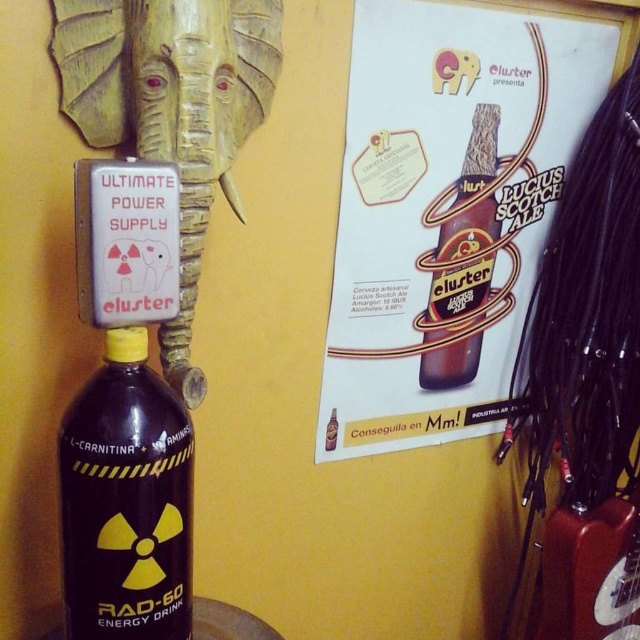
You are standing in front of the yellow wall with the elephant sculpture and the Lucius Scotch Ale poster. A small drone is hovering at point (196, 134). If the drone moves straight toward you, how far will it travel before reaching your position?

The point (196, 134) is 29.54 inches away from the viewer. Therefore, the drone will travel 29.54 inches to reach you.

You are an interior designer assessing the wall layout. The client wants to know if the matte paper poster at upper right and wooden elephant head at upper left are arranged in a way that the poster is positioned to the right of the elephant head. Can you confirm this?

Yes, the matte paper poster at upper right is positioned to the right of the wooden elephant head at upper left, as described.

You are an interior designer planning to hang a new picture between the matte paper poster at upper right and the brown glass bottle at upper center. Considering their sizes, which object should you place higher on the wall to maintain visual balance?

The matte paper poster at upper right is much taller than the brown glass bottle at upper center, so to maintain visual balance, you should place the matte paper poster at upper right higher on the wall to compensate for its greater height.